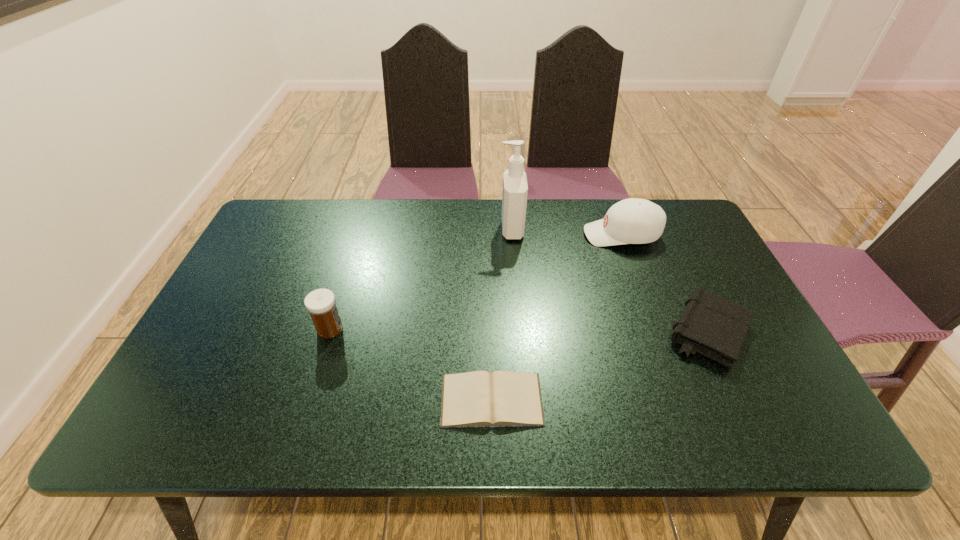
Where is `the tallest object`? the tallest object is located at coordinates (515, 188).

This screenshot has width=960, height=540. I want to click on baseball cap, so click(x=631, y=221).

Where is `medicine`? medicine is located at coordinates (321, 304).

Where is `the taller Bible`? Image resolution: width=960 pixels, height=540 pixels. the taller Bible is located at coordinates (715, 327).

You are a GUI agent. You are given a task and a screenshot of the screen. Output one action in this format:
    pyautogui.click(x=<x>, y=<y>)
    Task: Click on the second shortest object
    
    Given the screenshot: What is the action you would take?
    pyautogui.click(x=715, y=327)

At what (x,y) coordinates should I click in order to perform the action: click on the nearer Bible. Please return your answer as a coordinate pair (x, y). The width and height of the screenshot is (960, 540). Looking at the image, I should click on (502, 398).

Image resolution: width=960 pixels, height=540 pixels. I want to click on the shortest object, so point(502,398).

Locate an element on the screen. This screenshot has width=960, height=540. free location located 0.110m on the front label of the tallest object is located at coordinates (464, 230).

This screenshot has height=540, width=960. What are the coordinates of `vacant position located 0.400m on the front label of the tallest object` in the screenshot? It's located at (372, 230).

Find the location of a particular element. The image size is (960, 540). blank space located 0.150m on the front label of the tallest object is located at coordinates (451, 230).